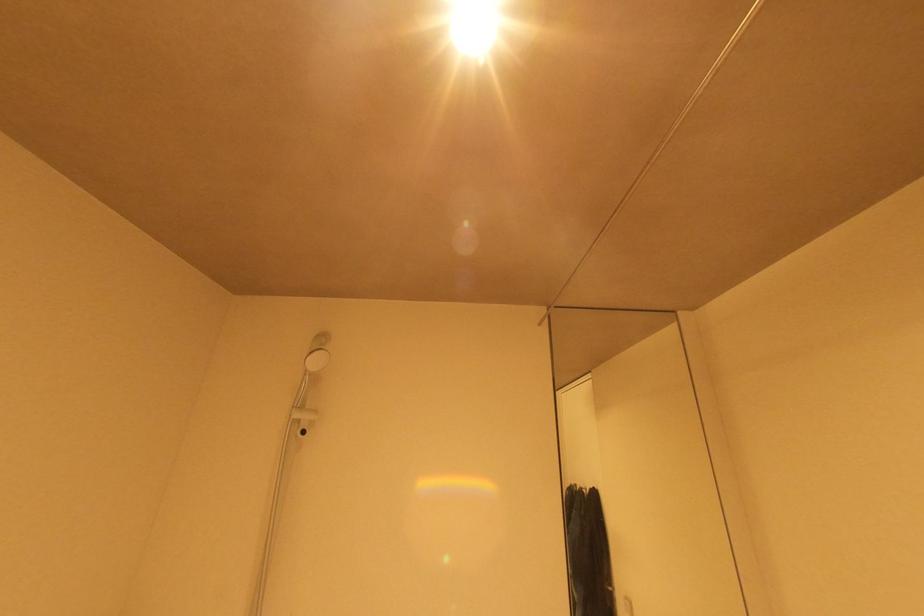
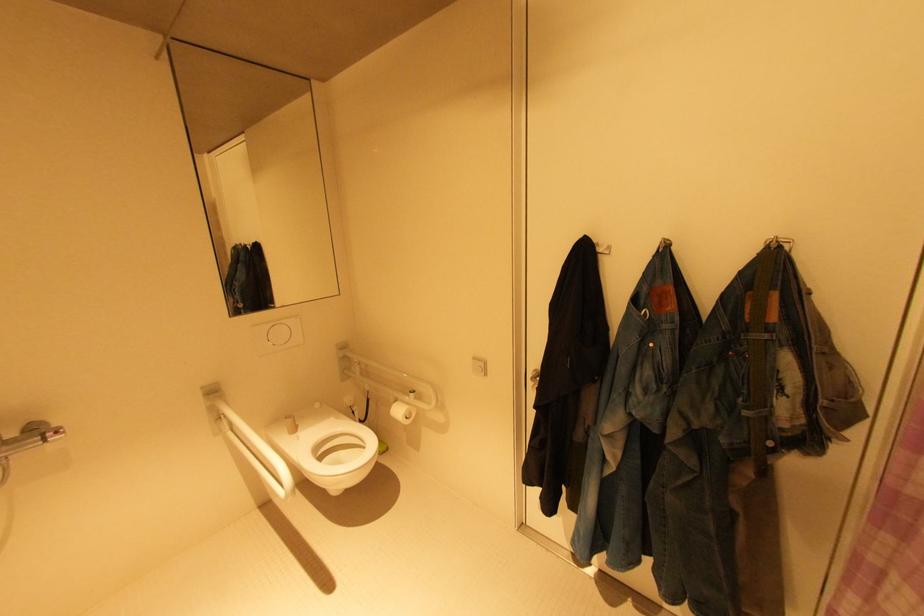
The images are taken continuously from a first-person perspective. In which direction is your viewpoint rotating?

The camera's rotation is toward right-down.